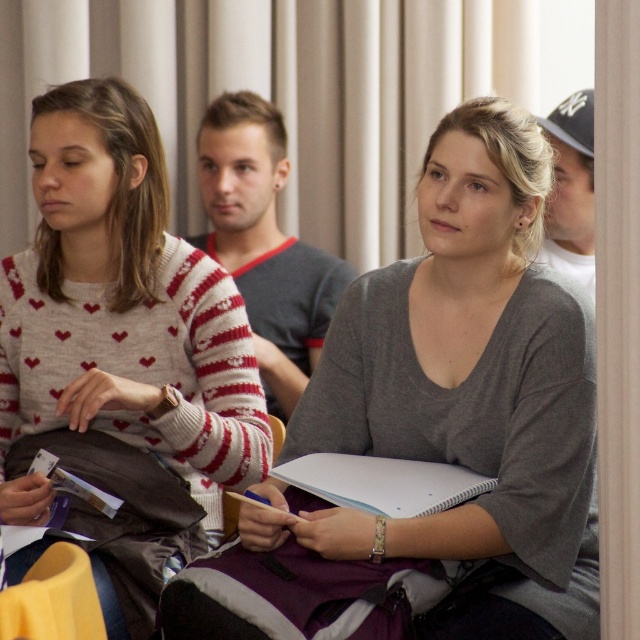
Question: Among these points, which one is nearest to the camera?

Choices:
 (A) (248, 445)
 (B) (589, 237)
 (C) (275, 228)
 (D) (205, 612)

Answer: (D)

Question: Which point is farther to the camera?

Choices:
 (A) (573, 202)
 (B) (275, 216)
 (C) (326, 496)

Answer: (B)

Question: In this image, where is knitted sweater at left located relative to white paper notebook at center?

Choices:
 (A) left
 (B) right

Answer: (A)

Question: Does gray cotton shirt at center have a smaller size compared to white paper notebook at center?

Choices:
 (A) yes
 (B) no

Answer: (B)

Question: Considering the real-world distances, which object is farthest from the knitted sweater at left?

Choices:
 (A) white paper notebook at center
 (B) gray matte sweater at center
 (C) gray cotton shirt at center
 (D) white cotton cap at upper right

Answer: (D)

Question: Does gray matte sweater at center lie in front of knitted sweater at left?

Choices:
 (A) no
 (B) yes

Answer: (B)